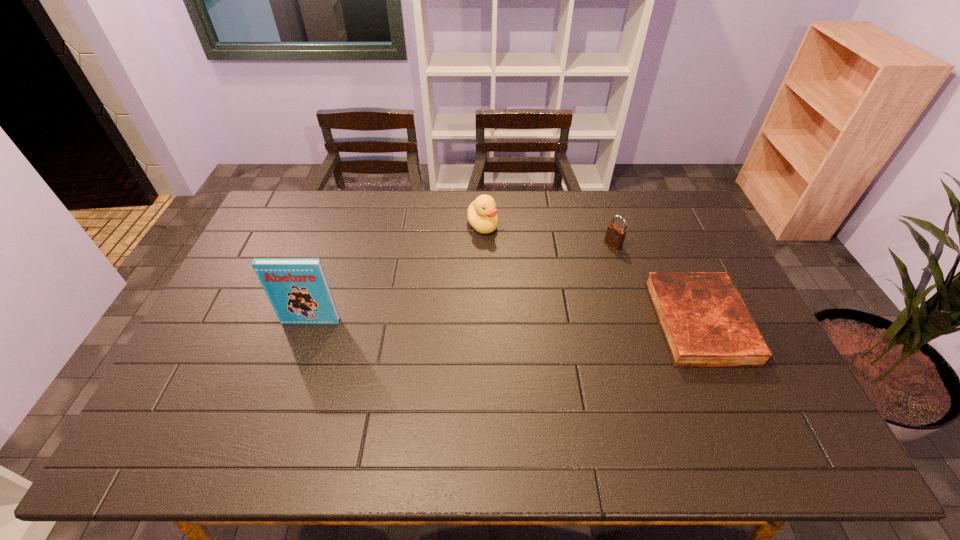
The width and height of the screenshot is (960, 540). In the image, there is a desktop. Identify the location of vacant region at the far left corner. (299, 215).

You are a GUI agent. You are given a task and a screenshot of the screen. Output one action in this format:
    pyautogui.click(x=<x>, y=<y>)
    Task: Click on the vacant space at the near left corner of the desktop
    The image size is (960, 540).
    Given the screenshot: What is the action you would take?
    pyautogui.click(x=186, y=387)

Locate an element on the screen. The image size is (960, 540). free space that is in between the second object from left to right and the book is located at coordinates (396, 273).

At what (x,y) coordinates should I click in order to perform the action: click on empty space that is in between the third object from left to right and the duck. Please return your answer as a coordinate pair (x, y). Looking at the image, I should click on (548, 234).

The image size is (960, 540). In order to click on empty space between the duck and the second farthest object in this screenshot , I will do `click(548, 234)`.

The width and height of the screenshot is (960, 540). Find the location of `vacant region between the rightmost object and the farthest object`. vacant region between the rightmost object and the farthest object is located at coordinates (591, 273).

Where is `vacant area that lies between the padlock and the tallest object`? This screenshot has width=960, height=540. vacant area that lies between the padlock and the tallest object is located at coordinates (462, 283).

Locate an element on the screen. vacant area between the shortest object and the tallest object is located at coordinates (506, 322).

The width and height of the screenshot is (960, 540). Find the location of `free spot between the leftmost object and the shortest object`. free spot between the leftmost object and the shortest object is located at coordinates tap(506, 322).

This screenshot has height=540, width=960. Identify the location of free spot between the padlock and the farthest object. (548, 234).